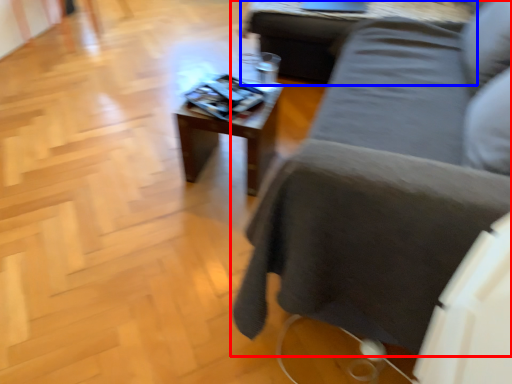
Question: Which point is closer to the camera, studio couch (highlighted by a red box) or table (highlighted by a blue box)?

Choices:
 (A) studio couch
 (B) table

Answer: (A)